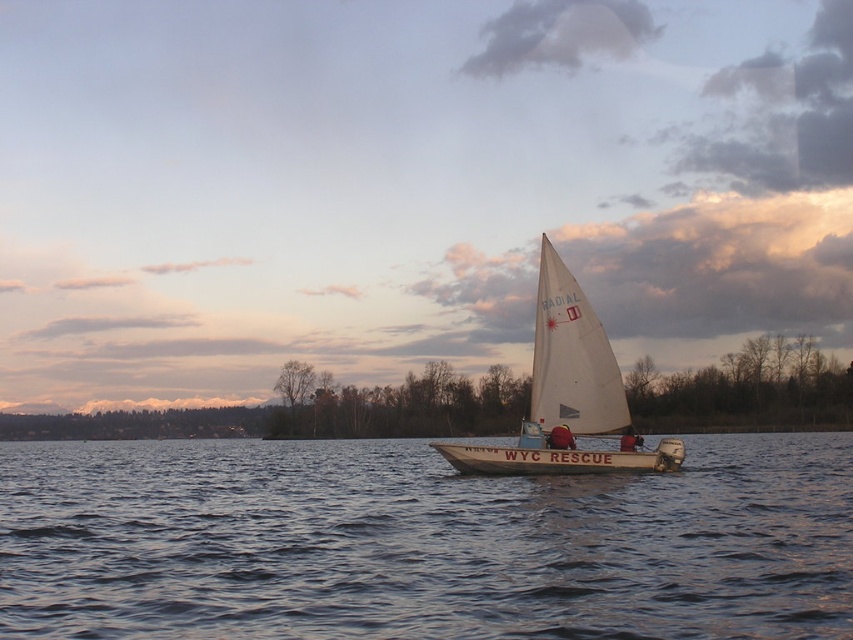
Does clear water at center appear under red fabric jacket at center?

Yes.

Which is more to the right, clear water at center or red fabric jacket at center?

red fabric jacket at center is more to the right.

Where is `clear water at center`? clear water at center is located at coordinates (421, 541).

Locate an element on the screen. This screenshot has height=640, width=853. clear water at center is located at coordinates (421, 541).

Based on the photo, who is taller, clear water at center or white sailboat at center?

With more height is clear water at center.

Is clear water at center thinner than white sailboat at center?

In fact, clear water at center might be wider than white sailboat at center.

This screenshot has width=853, height=640. What do you see at coordinates (421, 541) in the screenshot?
I see `clear water at center` at bounding box center [421, 541].

The width and height of the screenshot is (853, 640). In order to click on clear water at center in this screenshot , I will do `click(421, 541)`.

In the scene shown: Does white sailboat at center lie in front of red fabric jacket at center?

Yes, white sailboat at center is closer to the viewer.

Is white sailboat at center positioned behind red fabric jacket at center?

No, it is not.

Identify the location of white sailboat at center. Image resolution: width=853 pixels, height=640 pixels. (566, 394).

Identify the location of white sailboat at center. The image size is (853, 640). (566, 394).